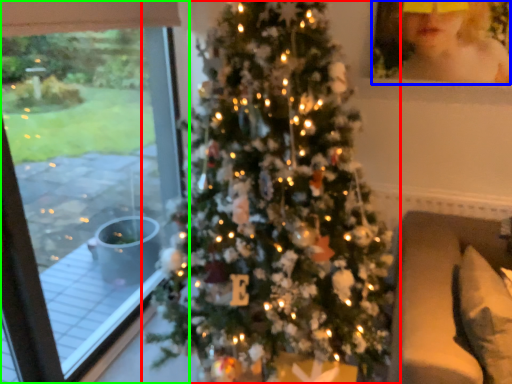
Question: Estimate the real-world distances between objects in this image. Which object is farther from christmas tree (highlighted by a red box), toddler (highlighted by a blue box) or window (highlighted by a green box)?

Choices:
 (A) toddler
 (B) window

Answer: (B)